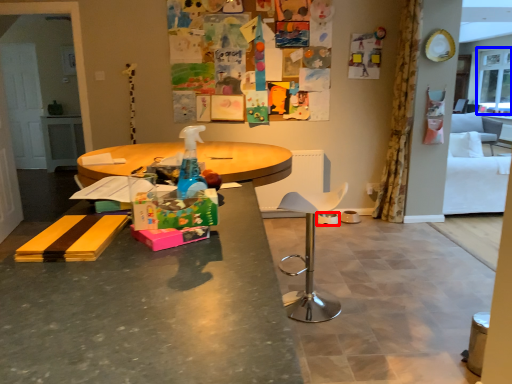
Question: Which object is closer to the camera taking this photo, bowl (highlighted by a red box) or window screen (highlighted by a blue box)?

Choices:
 (A) bowl
 (B) window screen

Answer: (A)